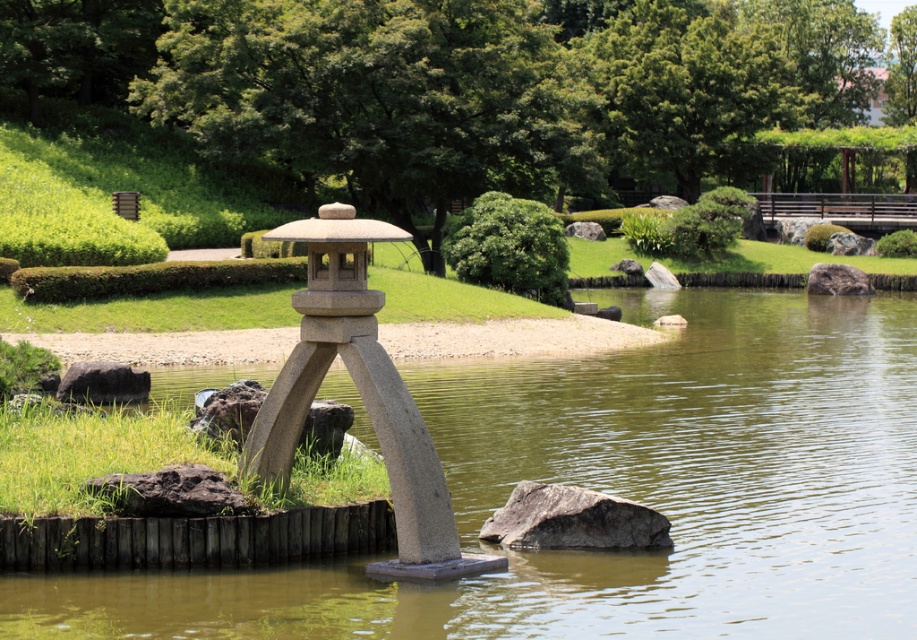
You are a gardener who needs to place a new decorative statue that is 2 meters wide between the smooth stone lantern at center and the gray rough rock at lower center. Can you fit the statue between them without moving either object?

The smooth stone lantern at center and the gray rough rock at lower center are 2.16 meters apart. Since the statue is 2 meters wide, it can fit between them as the distance is greater than the statue width.

You are standing in the Japanese garden and see two points marked in the image. Which point is closer to you, point (764, 346) or point (370, 324)?

Point (370, 324) is closer to you because it is less further to the camera than point (764, 346).

You are a visitor in the garden and want to take a photo of the smooth stone lantern at center without the gray rough rock at lower center appearing in the background. Is this possible given their positions?

Yes, since the smooth stone lantern at center is positioned in front of the gray rough rock at lower center, you can adjust your angle or move closer to the lantern to frame it without the rock in the background.